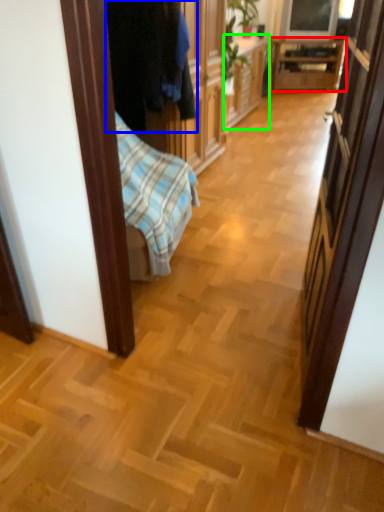
Question: Based on their relative distances, which object is farther from table (highlighted by a red box)? Choose from clothing (highlighted by a blue box) and cabinetry (highlighted by a green box).

Choices:
 (A) clothing
 (B) cabinetry

Answer: (A)